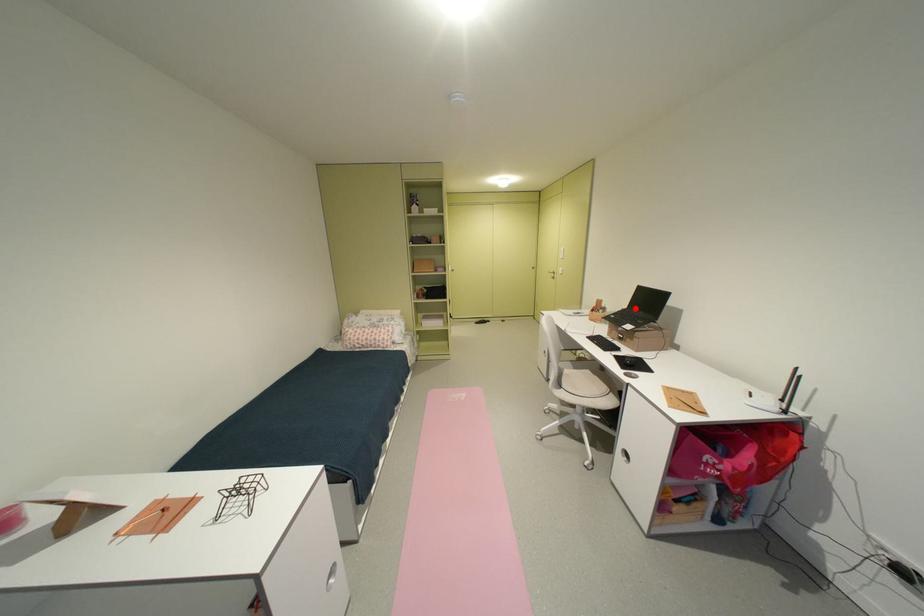
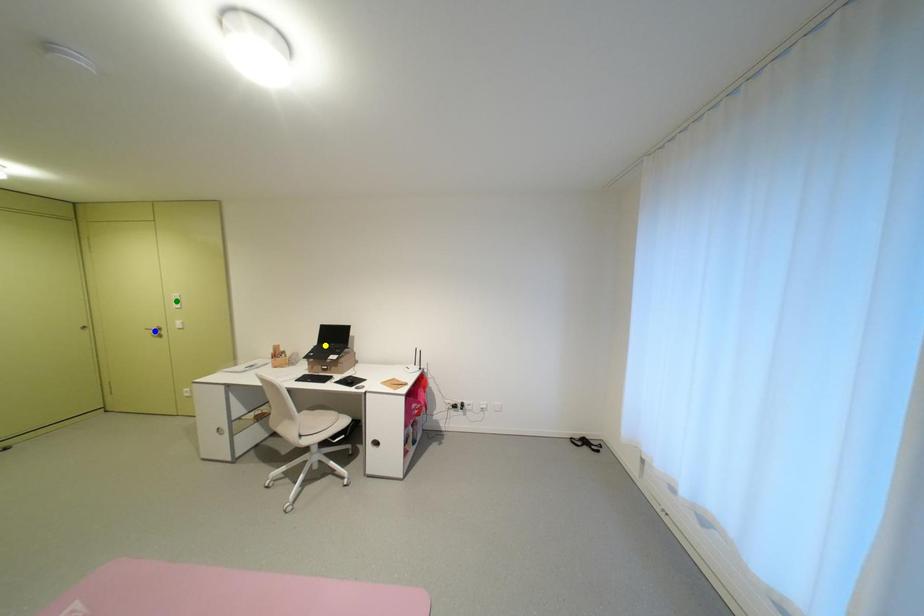
Question: I am providing you with two images of the same scene from different viewpoints. A red point is marked on the first image. You are given multiple points on the second image. Which mark in image 2 goes with the point in image 1?

Choices:
 (A) yellow point
 (B) green point
 (C) blue point

Answer: (A)